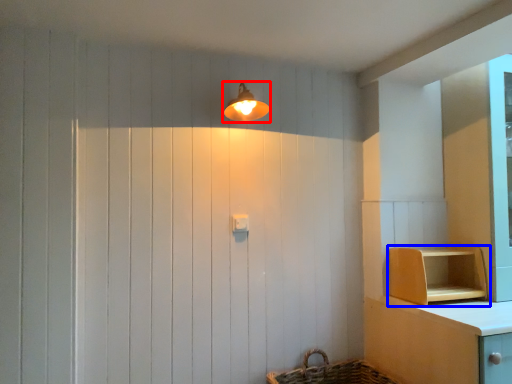
Question: Which object is further to the camera taking this photo, light fixture (highlighted by a red box) or shelf (highlighted by a blue box)?

Choices:
 (A) light fixture
 (B) shelf

Answer: (B)